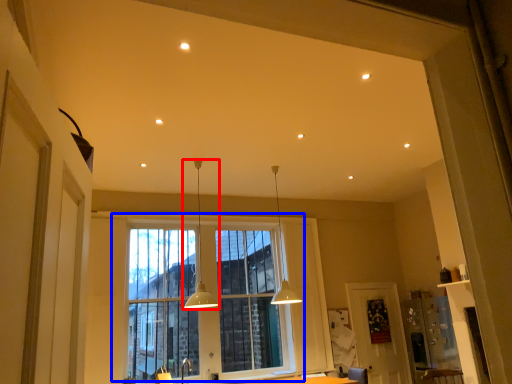
Question: Which of the following is the closest to the observer, lamp (highlighted by a red box) or window (highlighted by a blue box)?

Choices:
 (A) lamp
 (B) window

Answer: (A)